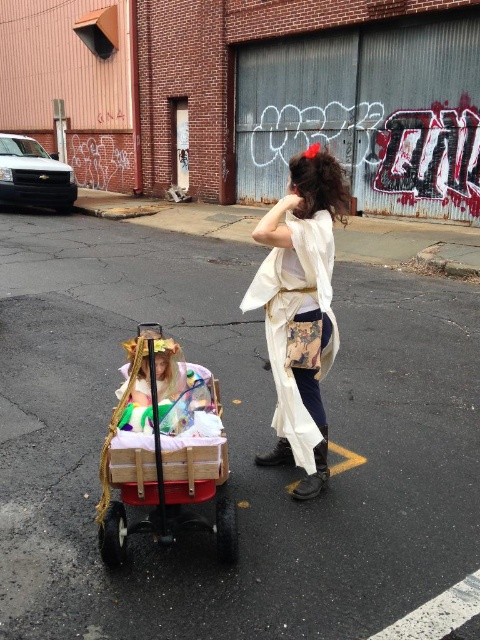
Question: Is wooden baby carriage at center closer to camera compared to white silk kimono at center?

Choices:
 (A) no
 (B) yes

Answer: (B)

Question: Can you confirm if wooden baby carriage at center is wider than white silk kimono at center?

Choices:
 (A) no
 (B) yes

Answer: (B)

Question: Which object appears closest to the camera in this image?

Choices:
 (A) wooden baby carriage at center
 (B) white silk kimono at center

Answer: (A)

Question: Which of the following is the closest to the observer?

Choices:
 (A) (190, 448)
 (B) (294, 388)

Answer: (A)

Question: Is wooden baby carriage at center smaller than white silk kimono at center?

Choices:
 (A) yes
 (B) no

Answer: (A)